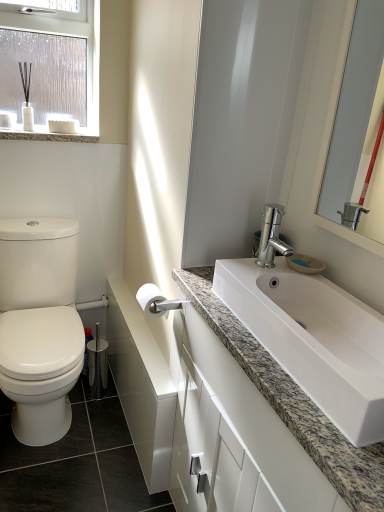
Question: Is granite countertop at upper left at the right side of white granite sink at center?

Choices:
 (A) yes
 (B) no

Answer: (B)

Question: Can you confirm if granite countertop at upper left is smaller than white granite sink at center?

Choices:
 (A) yes
 (B) no

Answer: (A)

Question: Does granite countertop at upper left have a lesser width compared to white granite sink at center?

Choices:
 (A) yes
 (B) no

Answer: (A)

Question: Is granite countertop at upper left aimed at white granite sink at center?

Choices:
 (A) no
 (B) yes

Answer: (A)

Question: Is granite countertop at upper left surrounding white granite sink at center?

Choices:
 (A) yes
 (B) no

Answer: (B)

Question: Is white granite sink at center taller or shorter than white matte toilet paper at center?

Choices:
 (A) tall
 (B) short

Answer: (A)

Question: Based on their sizes in the image, would you say white granite sink at center is bigger or smaller than white matte toilet paper at center?

Choices:
 (A) small
 (B) big

Answer: (B)

Question: Looking at their shapes, would you say white granite sink at center is wider or thinner than white matte toilet paper at center?

Choices:
 (A) thin
 (B) wide

Answer: (B)

Question: Which is correct: white granite sink at center is inside white matte toilet paper at center, or outside of it?

Choices:
 (A) outside
 (B) inside

Answer: (A)

Question: Is granite countertop at upper left in front of or behind white matte toilet paper at center in the image?

Choices:
 (A) front
 (B) behind

Answer: (B)

Question: Is granite countertop at upper left to the left or to the right of white matte toilet paper at center in the image?

Choices:
 (A) left
 (B) right

Answer: (A)

Question: Is point (8, 137) positioned closer to the camera than point (152, 290)?

Choices:
 (A) closer
 (B) farther

Answer: (B)

Question: From the image's perspective, relative to white matte toilet paper at center, is granite countertop at upper left above or below?

Choices:
 (A) below
 (B) above

Answer: (B)

Question: From the image's perspective, is white matte toilet paper at center located above or below granite countertop at upper left?

Choices:
 (A) below
 (B) above

Answer: (A)

Question: Is white matte toilet paper at center bigger or smaller than granite countertop at upper left?

Choices:
 (A) small
 (B) big

Answer: (A)